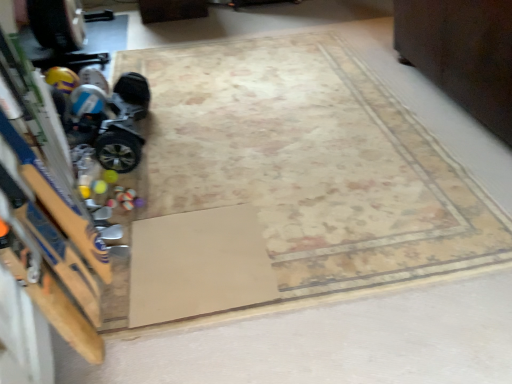
At what (x,y) coordinates should I click in order to perform the action: click on vacant area on the back side of brown cardboard at center. Please return your answer as a coordinate pair (x, y). The height and width of the screenshot is (384, 512). Looking at the image, I should click on 205,182.